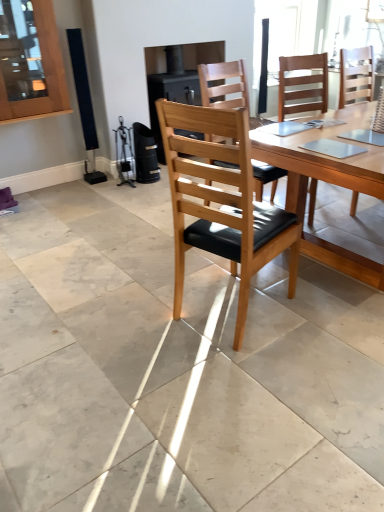
Question: Does wooden table at center have a larger size compared to wooden chair with black cushion at center, which is the third chair from back to front?

Choices:
 (A) yes
 (B) no

Answer: (A)

Question: Does wooden table at center have a greater height compared to wooden chair with black cushion at center, the first chair viewed from the front?

Choices:
 (A) no
 (B) yes

Answer: (A)

Question: Would you consider wooden table at center to be distant from wooden chair with black cushion at center, which is the third chair from back to front?

Choices:
 (A) no
 (B) yes

Answer: (A)

Question: Is wooden table at center facing towards wooden chair with black cushion at center, the first chair viewed from the front?

Choices:
 (A) no
 (B) yes

Answer: (B)

Question: From a real-world perspective, is wooden table at center positioned under wooden chair with black cushion at center, the first chair viewed from the front, based on gravity?

Choices:
 (A) yes
 (B) no

Answer: (A)

Question: Is point (228, 164) closer or farther from the camera than point (324, 253)?

Choices:
 (A) closer
 (B) farther

Answer: (A)

Question: From a real-world perspective, is light brown wood chair at center, the second chair in the front-to-back sequence, physically located above or below wooden table at center?

Choices:
 (A) below
 (B) above

Answer: (B)

Question: Is light brown wood chair at center, marked as the second chair in a back-to-front arrangement, wider or thinner than wooden table at center?

Choices:
 (A) wide
 (B) thin

Answer: (B)

Question: From the image's perspective, is light brown wood chair at center, marked as the second chair in a back-to-front arrangement, located above or below wooden table at center?

Choices:
 (A) below
 (B) above

Answer: (B)

Question: In the image, is wooden table at center on the left side or the right side of light brown wood chair at center, marked as the second chair in a back-to-front arrangement?

Choices:
 (A) right
 (B) left

Answer: (A)

Question: From their relative heights in the image, would you say wooden table at center is taller or shorter than light brown wood chair at center, the second chair in the front-to-back sequence?

Choices:
 (A) short
 (B) tall

Answer: (A)

Question: From a real-world perspective, is wooden table at center above or below light brown wood chair at center, marked as the second chair in a back-to-front arrangement?

Choices:
 (A) above
 (B) below

Answer: (B)

Question: Which is correct: wooden table at center is inside light brown wood chair at center, the second chair in the front-to-back sequence, or outside of it?

Choices:
 (A) outside
 (B) inside

Answer: (A)

Question: From a real-world perspective, is light brown wood chair at center, marked as the second chair in a back-to-front arrangement, positioned above or below wooden chair at center, arranged as the 3th chair when viewed from the front?

Choices:
 (A) above
 (B) below

Answer: (A)

Question: Considering the positions of light brown wood chair at center, marked as the second chair in a back-to-front arrangement, and wooden chair at center, which appears as the first chair when viewed from the back, in the image, is light brown wood chair at center, marked as the second chair in a back-to-front arrangement, taller or shorter than wooden chair at center, which appears as the first chair when viewed from the back,?

Choices:
 (A) short
 (B) tall

Answer: (A)